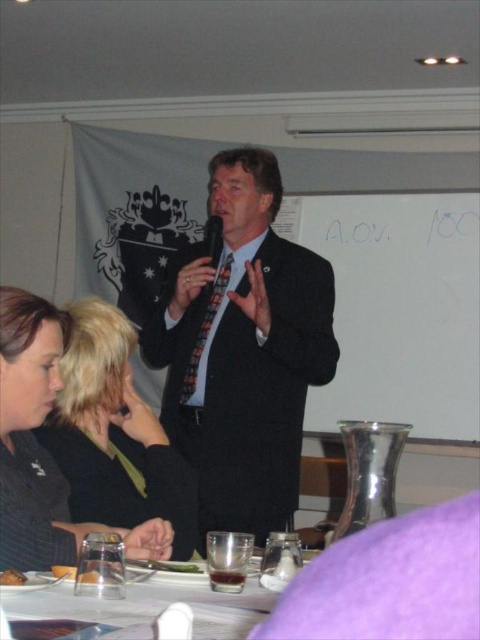
Question: Does matte black suit at center appear under black fabric hair at center?

Choices:
 (A) no
 (B) yes

Answer: (A)

Question: Can you confirm if matte black suit at center is positioned to the right of clear glass at lower center?

Choices:
 (A) no
 (B) yes

Answer: (B)

Question: Estimate the real-world distances between objects in this image. Which object is closer to the multicolored patterned tie at center?

Choices:
 (A) matte black suit at center
 (B) clear glass at lower center

Answer: (A)

Question: Is matte black suit at center wider than black fabric hair at center?

Choices:
 (A) no
 (B) yes

Answer: (B)

Question: Which point appears farthest from the camera in this image?

Choices:
 (A) (97, 614)
 (B) (262, 512)

Answer: (B)

Question: Which point is farther to the camera?

Choices:
 (A) matte black suit at center
 (B) black fabric hair at center
 (C) clear glass at lower center

Answer: (A)